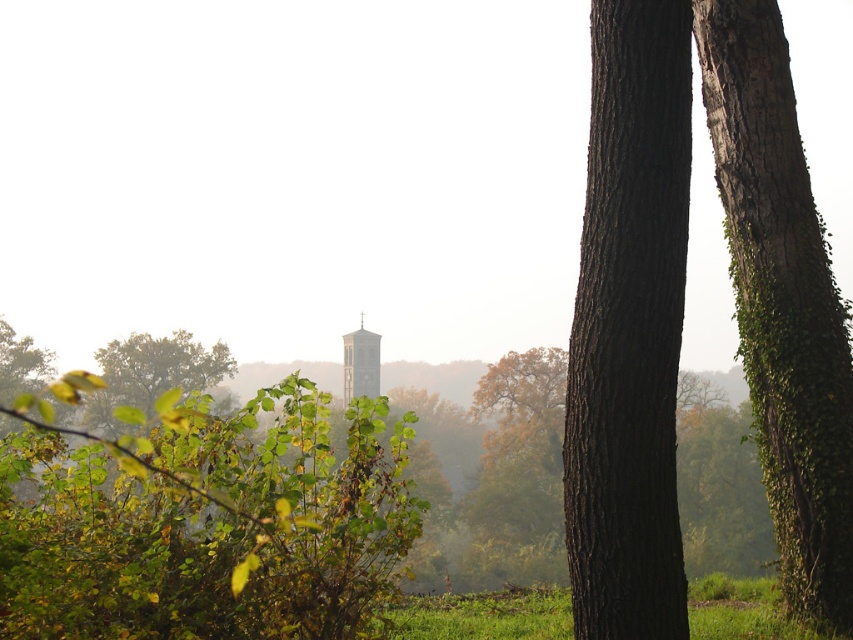
You are standing at the center of the image and want to walk towards the green grassy field at lower right. Which direction should you turn to face the dark brown textured tree trunk at right first before heading towards your destination?

You should turn to your right to face the dark brown textured tree trunk at right first, as it is to the left of the green grassy field at lower right. After facing the tree trunk, you can then proceed towards the green grassy field at lower right.

You are standing at the center of the image and want to locate the dark brown textured tree trunk at right. What are the coordinates of its position relative to the image center?

The dark brown textured tree trunk at right is located at coordinates point (x=630, y=328) relative to the image center.